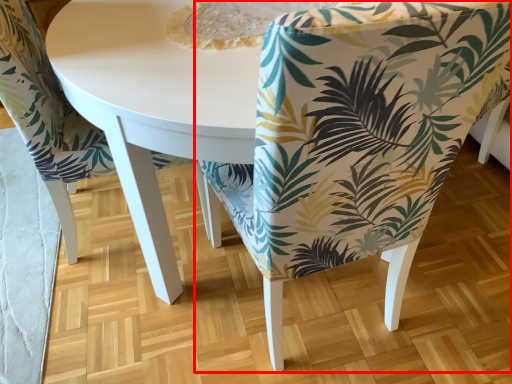
Question: In this image, where is chair (annotated by the red box) located relative to chair?

Choices:
 (A) left
 (B) right

Answer: (B)